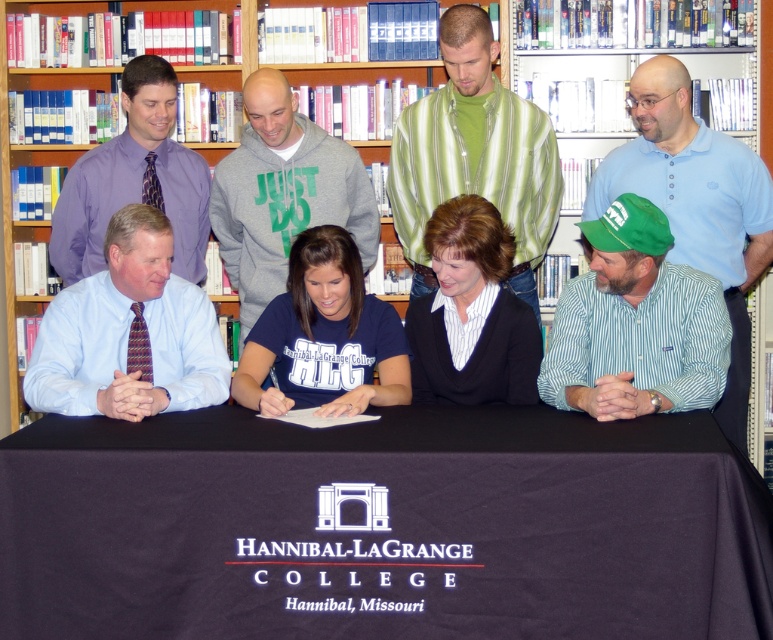
In the scene shown: You are attending the signing event at Hannibal LaGrange College. You see two people at the table, a blue shirt at left and a gray hoodie at center. Which one is closer to the left side of the table?

The blue shirt at left is closer to the left side of the table since it is positioned to the left of the gray hoodie at center.